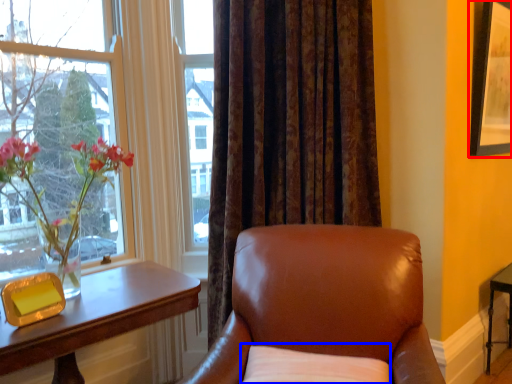
Question: Which object appears farthest to the camera in this image, picture frame (highlighted by a red box) or pillow (highlighted by a blue box)?

Choices:
 (A) picture frame
 (B) pillow

Answer: (A)